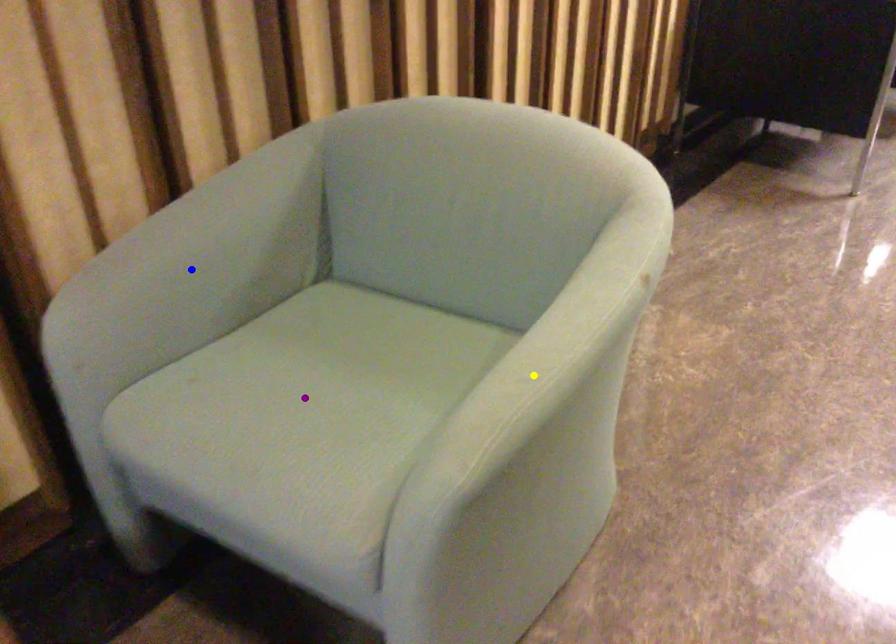
From the picture: Order these from nearest to farthest:
- yellow point
- blue point
- purple point

1. yellow point
2. purple point
3. blue point